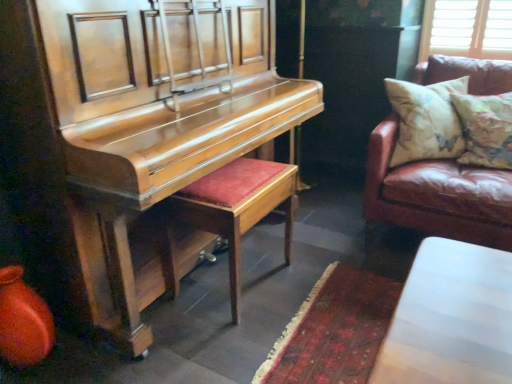
Measure the distance between point [269,164] and camera.

1.88 meters.

I want to click on floral fabric cushion at right, so click(485, 129).

This screenshot has height=384, width=512. I want to click on shiny wood harpsichord at left, so click(148, 140).

From the image's perspective, is leather couch at right over shiny wood harpsichord at left?

Yes, from the image's perspective, leather couch at right is above shiny wood harpsichord at left.

Is leather couch at right facing towards shiny wood harpsichord at left?

No, leather couch at right does not turn towards shiny wood harpsichord at left.

Is leather couch at right in contact with shiny wood harpsichord at left?

No, leather couch at right is not touching shiny wood harpsichord at left.

Is leather couch at right thinner than shiny wood harpsichord at left?

Correct, the width of leather couch at right is less than that of shiny wood harpsichord at left.

Is brown leather couch at right at the back of shiny wood harpsichord at left?

That's not correct — shiny wood harpsichord at left is not looking away from brown leather couch at right.

From a real-world perspective, is shiny wood harpsichord at left located higher than brown leather couch at right?

Yes, from a real-world perspective, shiny wood harpsichord at left is on top of brown leather couch at right.

Considering the relative sizes of shiny wood harpsichord at left and brown leather couch at right in the image provided, is shiny wood harpsichord at left thinner than brown leather couch at right?

No.

Looking at this image, is shiny wood harpsichord at left further to the viewer compared to floral fabric cushion at right?

No, the depth of shiny wood harpsichord at left is less than that of floral fabric cushion at right.

Which is in front, point (69, 94) or point (490, 110)?

The point (69, 94) is closer to the camera.

Can you confirm if shiny wood harpsichord at left is wider than floral fabric cushion at right?

Correct, the width of shiny wood harpsichord at left exceeds that of floral fabric cushion at right.

How distant is shiny wood harpsichord at left from floral fabric cushion at right?

shiny wood harpsichord at left and floral fabric cushion at right are 3.83 feet apart from each other.

Between point (440, 163) and point (269, 212), which one is positioned behind?

The point (440, 163) is behind.

Would you say leather couch at right is inside or outside velvet red stool at center?

leather couch at right is not enclosed by velvet red stool at center.

Is leather couch at right behind velvet red stool at center?

Yes, it is behind velvet red stool at center.

Is leather couch at right with velvet red stool at center?

No, leather couch at right is not in contact with velvet red stool at center.

Is leather couch at right at the back of brown leather couch at right?

Absolutely, brown leather couch at right is directed away from leather couch at right.

Between brown leather couch at right and leather couch at right, which one has more height?

Result: brown leather couch at right.

From the image's perspective, between brown leather couch at right and leather couch at right, which one is located above?

brown leather couch at right is shown above in the image.

From a real-world perspective, is brown leather couch at right positioned over leather couch at right based on gravity?

No.

From the image's perspective, is velvet red stool at center under leather couch at right?

Yes, from the image's perspective, velvet red stool at center is beneath leather couch at right.

How much distance is there between velvet red stool at center and leather couch at right?

25.57 inches.

From a real-world perspective, is velvet red stool at center above or below leather couch at right?

From a real-world perspective, velvet red stool at center is physically below leather couch at right.

Is velvet red stool at center with leather couch at right?

They are not placed beside each other.

Is floral fabric cushion at right inside the boundaries of velvet red stool at center, or outside?

floral fabric cushion at right exists outside the volume of velvet red stool at center.

Can you see floral fabric cushion at right touching velvet red stool at center?

There is a gap between floral fabric cushion at right and velvet red stool at center.

Does floral fabric cushion at right have a greater width compared to velvet red stool at center?

Incorrect, the width of floral fabric cushion at right does not surpass that of velvet red stool at center.

Is point (509, 136) less distant than point (283, 164)?

No, (509, 136) is behind (283, 164).

Where is `harpsichord above the leather couch at right (from a real-world perspective)`? The image size is (512, 384). harpsichord above the leather couch at right (from a real-world perspective) is located at coordinates (148, 140).

The height and width of the screenshot is (384, 512). I want to click on dark behind the shiny wood harpsichord at left, so click(352, 88).

Estimate the real-world distances between objects in this image. Which object is further from floral fabric cushion at right, shiny wood harpsichord at left or brown leather couch at right?

The object further to floral fabric cushion at right is shiny wood harpsichord at left.

From the image, which object appears to be farther from velvet red stool at center, leather couch at right or shiny wood harpsichord at left?

Based on the image, leather couch at right appears to be further to velvet red stool at center.

Which object lies further to the anchor point floral fabric cushion at right, leather couch at right or brown leather couch at right?

The object further to floral fabric cushion at right is brown leather couch at right.

From the image, which object appears to be nearer to shiny wood harpsichord at left, velvet red stool at center or brown leather couch at right?

Among the two, velvet red stool at center is located nearer to shiny wood harpsichord at left.

Considering their positions, is brown leather couch at right positioned closer to velvet red stool at center than floral fabric cushion at right?

floral fabric cushion at right is positioned closer to the anchor velvet red stool at center.

When comparing their distances from shiny wood harpsichord at left, does brown leather couch at right or leather couch at right seem further?

brown leather couch at right lies further to shiny wood harpsichord at left than the other object.

Based on the photo, considering their positions, is brown leather couch at right positioned further to velvet red stool at center than shiny wood harpsichord at left?

brown leather couch at right is further to velvet red stool at center.

When comparing their distances from brown leather couch at right, does shiny wood harpsichord at left or floral fabric cushion at right seem further?

Based on the image, shiny wood harpsichord at left appears to be further to brown leather couch at right.

I want to click on dark between velvet red stool at center and leather couch at right from left to right, so click(x=352, y=88).

Identify the location of stool located between shiny wood harpsichord at left and leather couch at right in the left-right direction. (237, 207).

At what (x,y) coordinates should I click in order to perform the action: click on studio couch situated between velvet red stool at center and floral fabric cushion at right from left to right. Please return your answer as a coordinate pair (x, y). This screenshot has height=384, width=512. Looking at the image, I should click on (436, 195).

The image size is (512, 384). Identify the location of studio couch between floral fabric cushion at right and brown leather couch at right in the front-back direction. (436, 195).